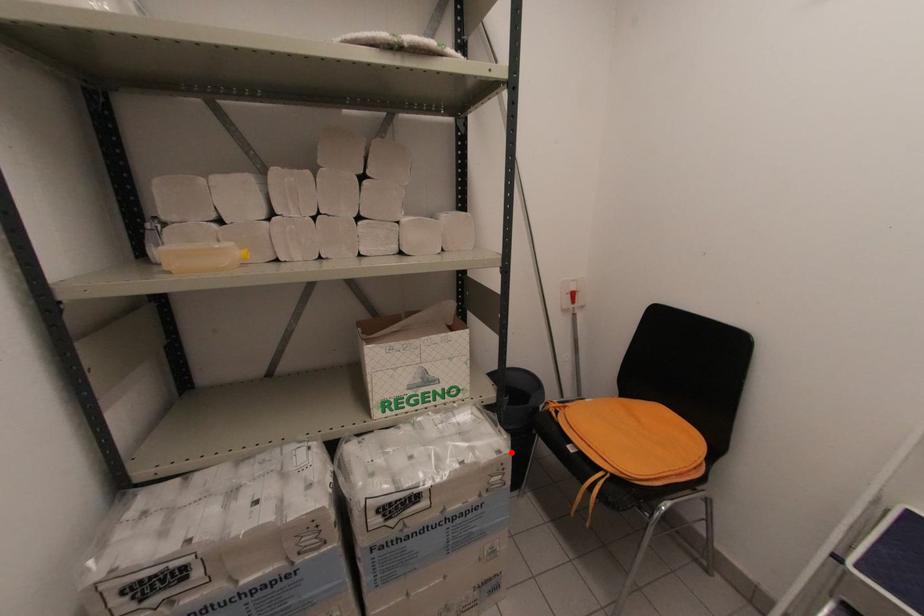
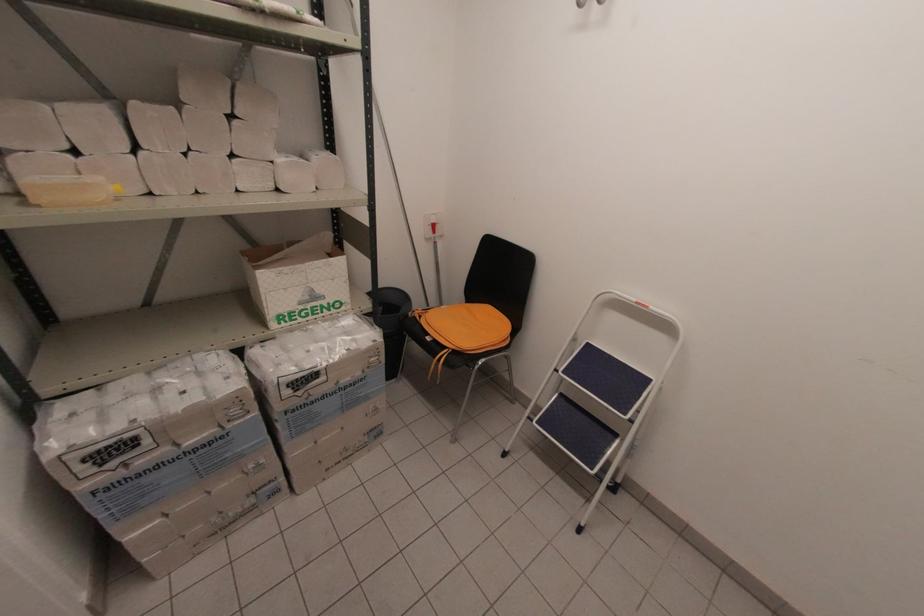
Question: I am providing you with two images of the same scene from different viewpoints. A red point is marked on the first image. Is the red point's position out of view in image 2?

Choices:
 (A) Yes
 (B) No

Answer: (B)